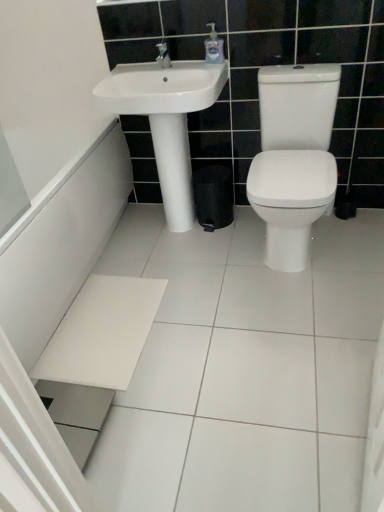
The image size is (384, 512). In order to click on vacant area situated below white glossy sink at upper center (from a real-world perspective) in this screenshot , I will do `click(163, 226)`.